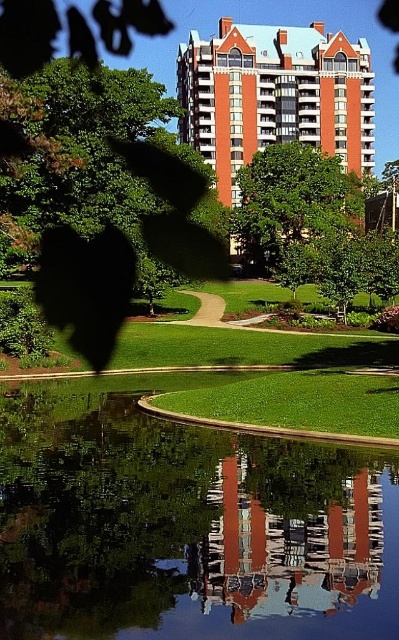
Who is more forward, (365, 452) or (231, 138)?

Positioned in front is point (365, 452).

Does point (187, 561) lie in front of point (343, 100)?

Yes.

This screenshot has height=640, width=399. I want to click on transparent glass water at center, so click(187, 529).

Is transparent glass water at center wider than green leafy tree at center?

No.

Is transparent glass water at center further to the viewer compared to green leafy tree at center?

No, transparent glass water at center is in front of green leafy tree at center.

Does point (343, 536) come in front of point (276, 196)?

Yes, it is.

In order to click on transparent glass water at center in this screenshot , I will do `click(187, 529)`.

Between smooth glass building at center and green leafy tree at center, which one is positioned lower?

Positioned lower is smooth glass building at center.

Which of these two, smooth glass building at center or green leafy tree at center, stands shorter?

With less height is smooth glass building at center.

Between point (312, 532) and point (306, 156), which one is positioned behind?

Point (306, 156)

In order to click on smooth glass building at center in this screenshot , I will do `click(288, 531)`.